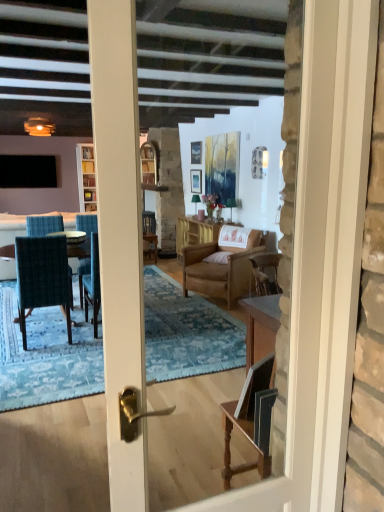
Question: Does teal fabric chair at left, the 2th chair positioned from the right, come behind matte glass candle at upper left?

Choices:
 (A) no
 (B) yes

Answer: (A)

Question: From a real-world perspective, is teal fabric chair at left, the 2th chair positioned from the right, over matte glass candle at upper left?

Choices:
 (A) yes
 (B) no

Answer: (B)

Question: Are teal fabric chair at left, the 2th chair positioned from the back, and matte glass candle at upper left making contact?

Choices:
 (A) no
 (B) yes

Answer: (A)

Question: Is teal fabric chair at left, the 2th chair positioned from the back, far away from matte glass candle at upper left?

Choices:
 (A) yes
 (B) no

Answer: (A)

Question: Considering the relative sizes of teal fabric chair at left, placed as the first chair when sorted from left to right, and matte glass candle at upper left in the image provided, is teal fabric chair at left, placed as the first chair when sorted from left to right, shorter than matte glass candle at upper left?

Choices:
 (A) yes
 (B) no

Answer: (B)

Question: Which is correct: teal fabric chair at left, the 2th chair positioned from the back, is inside brown woven table at center, or outside of it?

Choices:
 (A) outside
 (B) inside

Answer: (A)

Question: Considering the relative positions of teal fabric chair at left, the 2th chair positioned from the back, and brown woven table at center in the image provided, is teal fabric chair at left, the 2th chair positioned from the back, to the left or to the right of brown woven table at center?

Choices:
 (A) right
 (B) left

Answer: (B)

Question: In the image, is teal fabric chair at left, the 2th chair positioned from the back, positioned in front of or behind brown woven table at center?

Choices:
 (A) front
 (B) behind

Answer: (A)

Question: From the image's perspective, relative to brown woven table at center, is teal fabric chair at left, the 2th chair positioned from the back, above or below?

Choices:
 (A) above
 (B) below

Answer: (B)

Question: Is black matte television at left inside or outside of matte wooden picture frame at center, the first picture frame from the bottom?

Choices:
 (A) inside
 (B) outside

Answer: (B)

Question: Looking at the image, does black matte television at left seem bigger or smaller compared to matte wooden picture frame at center, the first picture frame from the bottom?

Choices:
 (A) big
 (B) small

Answer: (A)

Question: Based on their positions, is black matte television at left located to the left or right of matte wooden picture frame at center, the first picture frame from the bottom?

Choices:
 (A) right
 (B) left

Answer: (B)

Question: From a real-world perspective, is black matte television at left physically located above or below matte wooden picture frame at center, which is counted as the 2th picture frame, starting from the top?

Choices:
 (A) below
 (B) above

Answer: (B)

Question: Is matte wooden picture frame at center, which is counted as the 2th picture frame, starting from the top, wider or thinner than metallic silver picture frame at upper center, the 2th picture frame when ordered from bottom to top?

Choices:
 (A) thin
 (B) wide

Answer: (B)

Question: Would you say matte wooden picture frame at center, the first picture frame from the bottom, is to the left or to the right of metallic silver picture frame at upper center, the 2th picture frame when ordered from bottom to top, in the picture?

Choices:
 (A) left
 (B) right

Answer: (B)